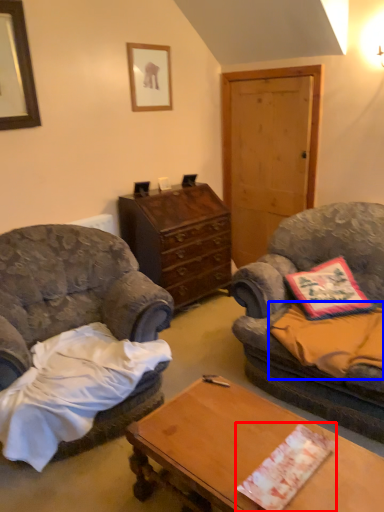
Question: Which object appears farthest to the camera in this image, sheet (highlighted by a red box) or sheet (highlighted by a blue box)?

Choices:
 (A) sheet
 (B) sheet

Answer: (B)